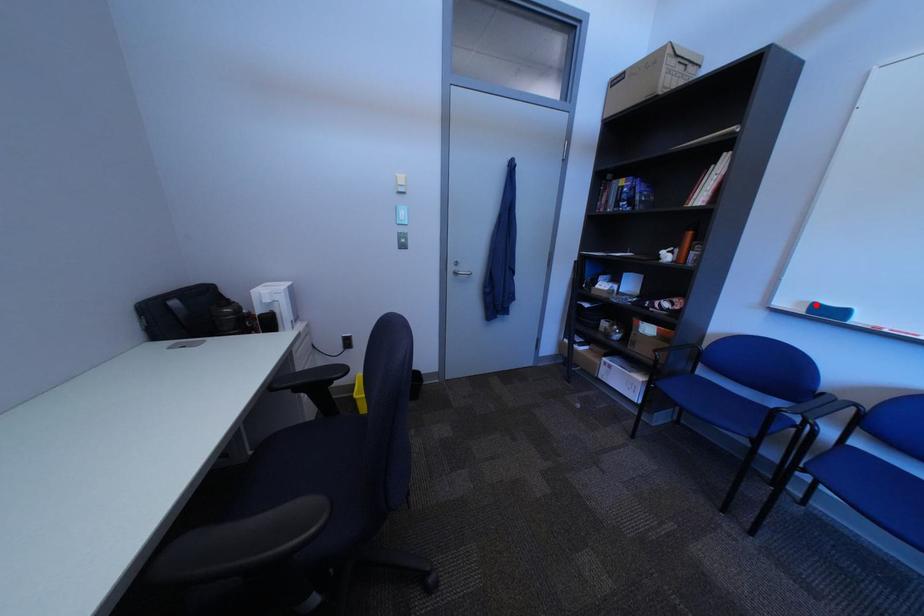
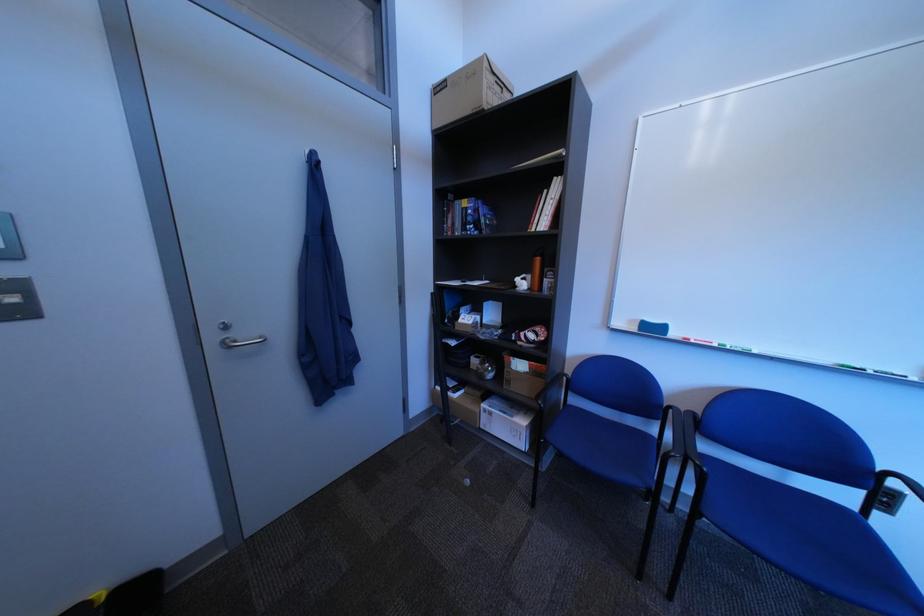
Locate, in the second image, the point that corresponds to the highlighted location in the first image.

(647, 323)